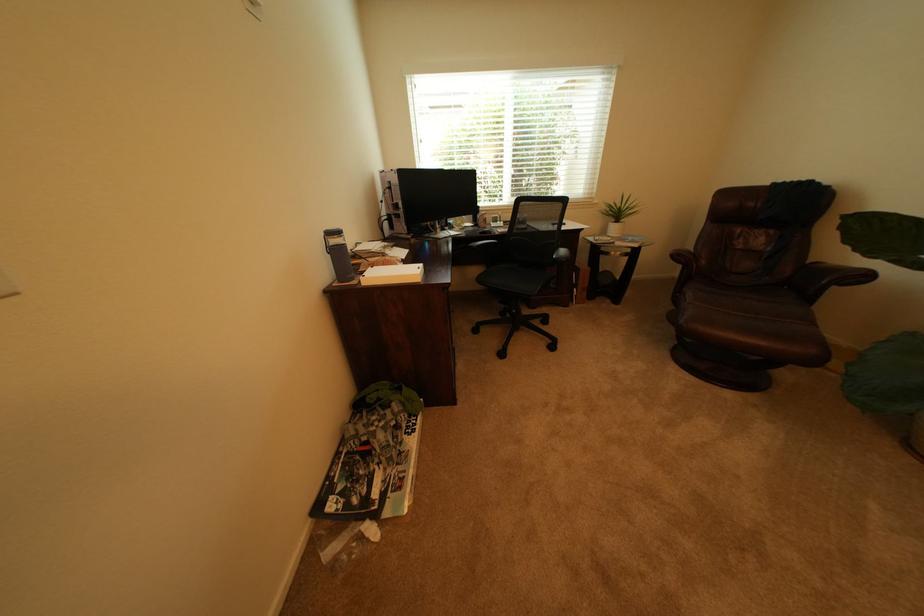
The location [485,230] corresponds to which object?

This point indicates the black computer mouse.